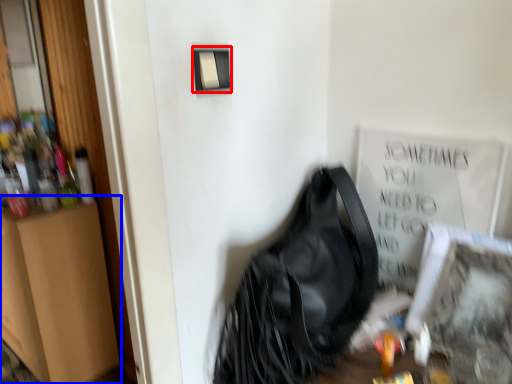
Question: Which object appears closest to the camera in this image, light switch (highlighted by a red box) or dresser (highlighted by a blue box)?

Choices:
 (A) light switch
 (B) dresser

Answer: (A)